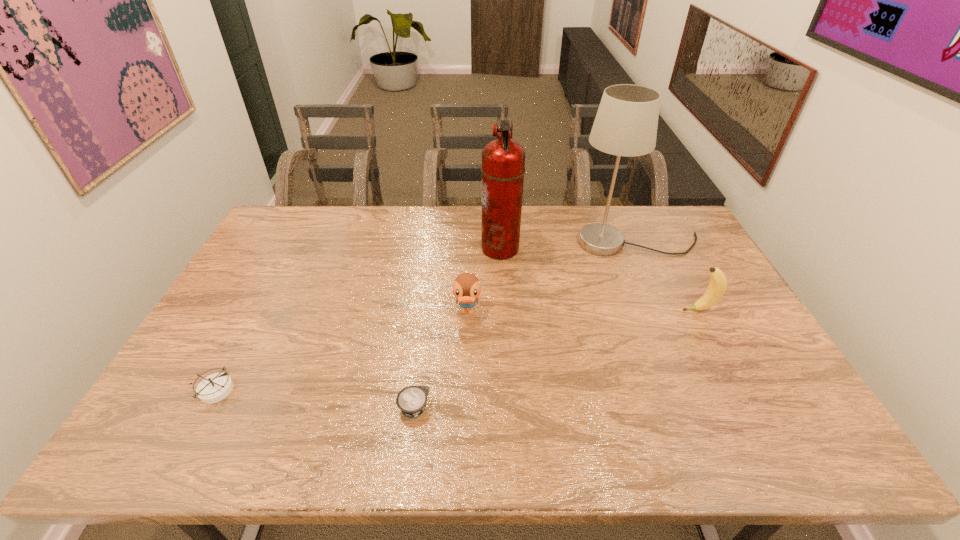
Where is `free space located 0.090m on the nozzle side of the fire extinguisher`? free space located 0.090m on the nozzle side of the fire extinguisher is located at coordinates (455, 248).

In order to click on vacant space situated 0.280m on the nozzle side of the fire extinguisher in this screenshot , I will do `click(400, 248)`.

Image resolution: width=960 pixels, height=540 pixels. Find the location of `vacant point located 0.230m on the nozzle side of the fire extinguisher`. vacant point located 0.230m on the nozzle side of the fire extinguisher is located at coordinates (415, 248).

Where is `free space located 0.310m from the stem of the third tallest object`? free space located 0.310m from the stem of the third tallest object is located at coordinates (578, 310).

Locate an element on the screen. This screenshot has height=540, width=960. vacant position located 0.270m from the stem of the third tallest object is located at coordinates (591, 310).

At what (x,y) coordinates should I click in order to perform the action: click on free space located 0.210m from the stem of the third tallest object. Please return your answer as a coordinate pair (x, y). This screenshot has width=960, height=540. Looking at the image, I should click on [612, 310].

The width and height of the screenshot is (960, 540). I want to click on blank space located on the front-facing side of the duck, so click(x=466, y=377).

Locate an element on the screen. The height and width of the screenshot is (540, 960). vacant space located on the back of the fifth tallest object is located at coordinates (242, 340).

Where is `vacant area situated on the back of the shortest object`? The height and width of the screenshot is (540, 960). vacant area situated on the back of the shortest object is located at coordinates (420, 354).

The height and width of the screenshot is (540, 960). Find the location of `table lamp at the far edge`. table lamp at the far edge is located at coordinates (626, 122).